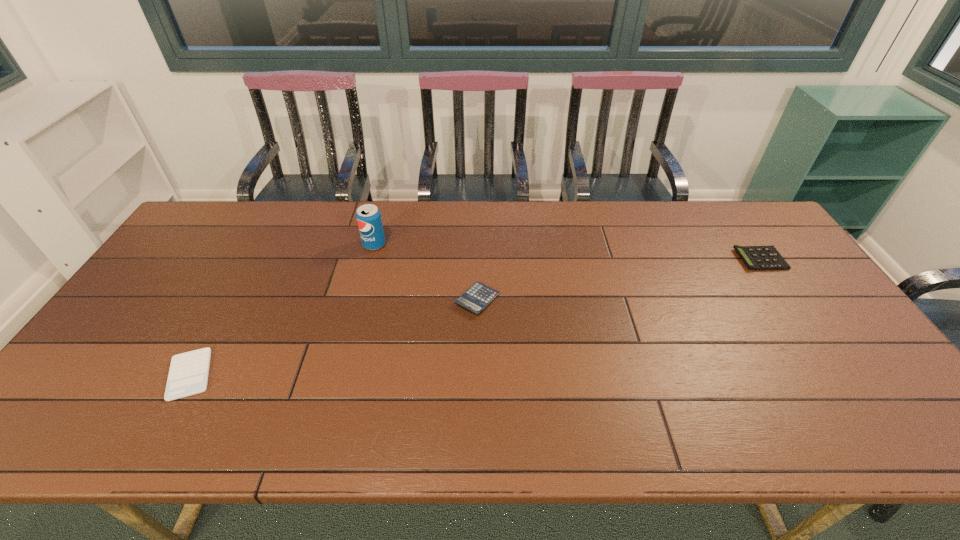
This screenshot has width=960, height=540. I want to click on vacant space located on the back of the rightmost object, so click(744, 236).

The image size is (960, 540). I want to click on free location located 0.340m on the back of the leftmost calculator, so click(x=252, y=260).

Identify the location of object at the far edge. The image size is (960, 540). (368, 216).

Where is `object that is at the right edge`? object that is at the right edge is located at coordinates (759, 258).

Find the location of a particular element. free location at the far edge is located at coordinates (296, 238).

Where is `vacant space at the near edge`? The image size is (960, 540). vacant space at the near edge is located at coordinates (457, 436).

You are a GUI agent. You are given a task and a screenshot of the screen. Output one action in this format:
    pyautogui.click(x=<x>, y=<y>)
    Task: Click on the free location at the left edge
    
    Given the screenshot: What is the action you would take?
    pyautogui.click(x=156, y=346)

Where is `vacant space at the right edge`? The width and height of the screenshot is (960, 540). vacant space at the right edge is located at coordinates (772, 278).

Where is `free space at the far right corner of the desktop`? The width and height of the screenshot is (960, 540). free space at the far right corner of the desktop is located at coordinates (737, 220).

Locate an element on the screen. The width and height of the screenshot is (960, 540). empty location between the nearest object and the rightmost object is located at coordinates point(475,317).